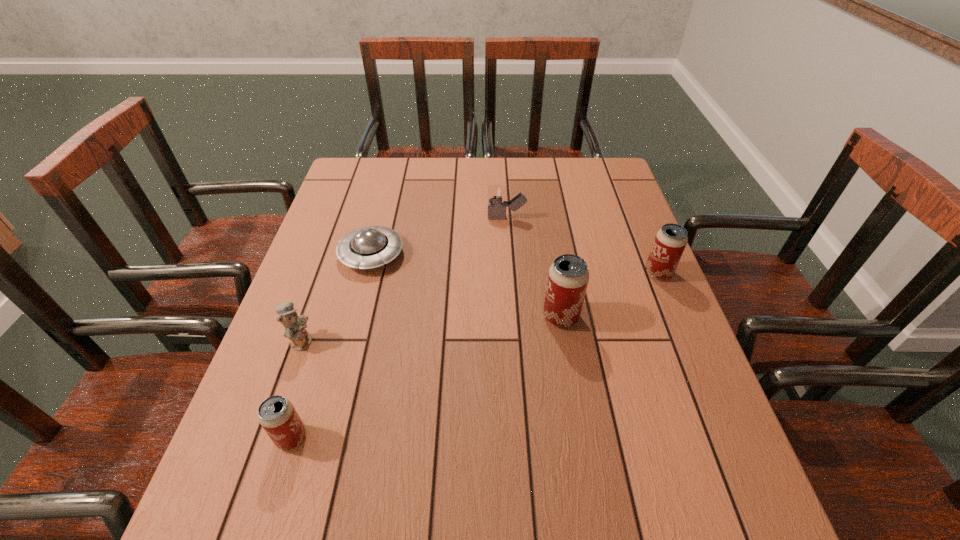
Locate an element on the screen. the nearest beer can is located at coordinates (276, 414).

I want to click on the leftmost beer can, so click(276, 414).

Locate an element on the screen. Image resolution: width=960 pixels, height=540 pixels. the tallest beer can is located at coordinates (568, 276).

Identify the location of the second object from right to left. (568, 276).

The width and height of the screenshot is (960, 540). Find the location of `the rightmost object`. the rightmost object is located at coordinates (670, 241).

Identify the location of the farthest beer can. (670, 241).

Find the location of `igniter`. igniter is located at coordinates (497, 194).

What are the coordinates of `the third object from right to left` in the screenshot? It's located at (497, 194).

What are the coordinates of `saucer` in the screenshot? It's located at (368, 247).

The height and width of the screenshot is (540, 960). I want to click on teddy bear, so click(300, 339).